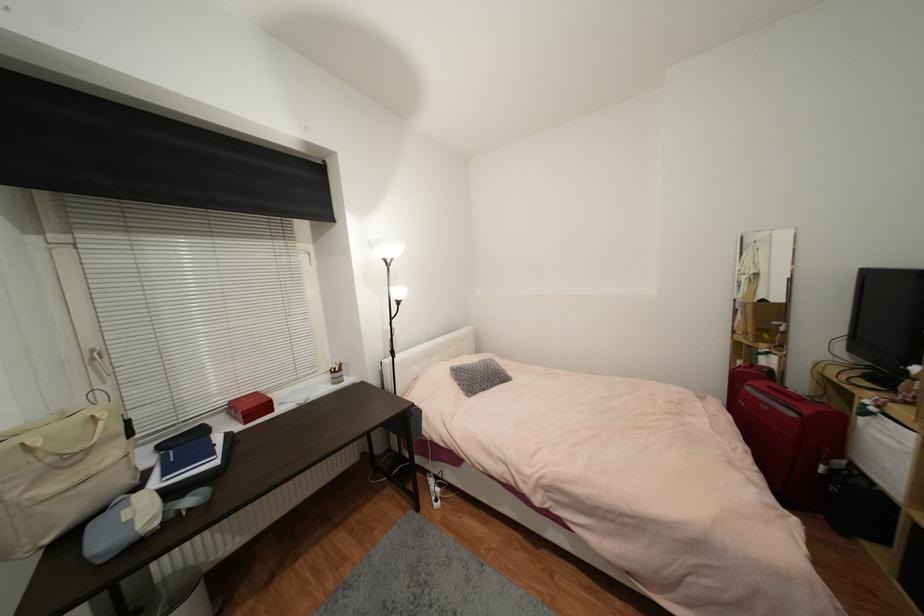
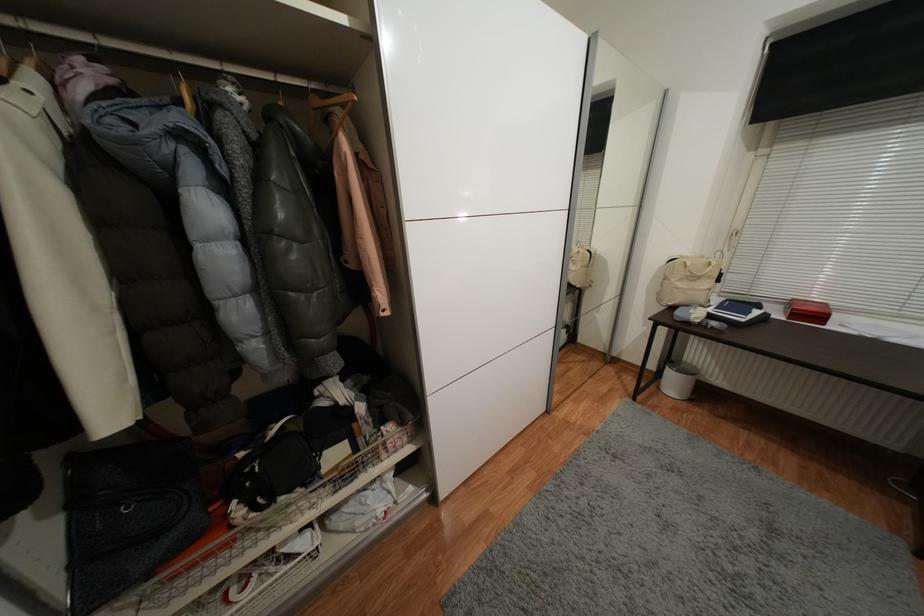
Where in the second image is the point corresponding to (222,464) from the first image?

(747, 321)